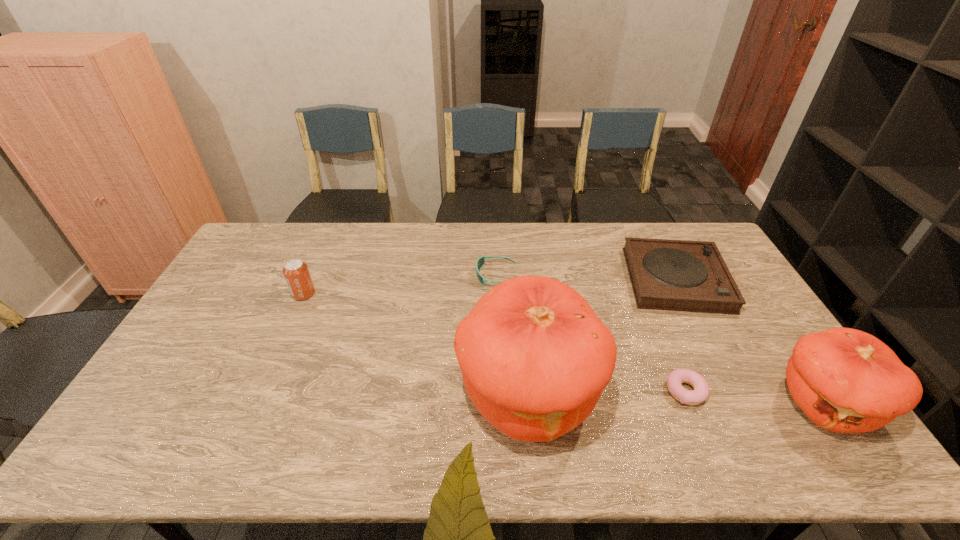
This screenshot has width=960, height=540. Find the location of `vacant region located 0.190m on the left of the shorter pumpkin`. vacant region located 0.190m on the left of the shorter pumpkin is located at coordinates (702, 404).

At what (x,y) coordinates should I click in order to perform the action: click on free space located 0.060m on the left of the fourth shortest object. Please return your answer as a coordinate pair (x, y). The image size is (960, 540). Looking at the image, I should click on (274, 294).

Identify the location of free space located 0.350m on the front-facing side of the second shortest object. The width and height of the screenshot is (960, 540). (373, 275).

Identify the location of free location located 0.290m on the front-facing side of the second shortest object. (391, 275).

What are the coordinates of `vacant region located on the front-facing side of the second shortest object` in the screenshot? It's located at (438, 275).

Find the location of a particular element. This screenshot has width=960, height=540. vacant point located 0.340m on the front of the phonograph record is located at coordinates (743, 411).

This screenshot has height=540, width=960. I want to click on vacant position located on the left of the doughnut, so click(586, 392).

Where is `object situated at the far edge`? The width and height of the screenshot is (960, 540). object situated at the far edge is located at coordinates (676, 275).

Where is `doughnut present at the near edge`? doughnut present at the near edge is located at coordinates (675, 379).

Where is `pumpkin that is at the right edge`? The height and width of the screenshot is (540, 960). pumpkin that is at the right edge is located at coordinates (845, 380).